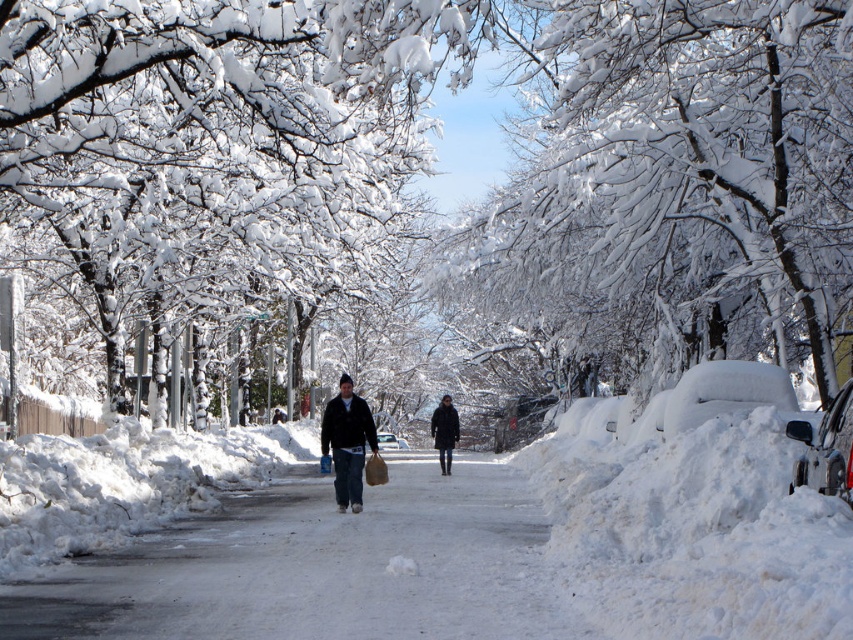
Does white snow-covered tree at center have a lesser width compared to dark blue denim jacket at center?

No.

Measure the distance between white snow-covered tree at center and dark blue denim jacket at center.

A distance of 43.16 feet exists between white snow-covered tree at center and dark blue denim jacket at center.

Locate an element on the screen. white snow-covered tree at center is located at coordinates (674, 189).

Identify the location of white snow-covered tree at center. The height and width of the screenshot is (640, 853). (674, 189).

At what (x,y) coordinates should I click in order to perform the action: click on white snow-covered tree at center. Please return your answer as a coordinate pair (x, y). Image resolution: width=853 pixels, height=640 pixels. Looking at the image, I should click on (674, 189).

Which is behind, point (714, 45) or point (445, 456)?

Positioned behind is point (445, 456).

In order to click on white snow-covered tree at center in this screenshot , I will do `click(674, 189)`.

Describe the element at coordinates (347, 442) in the screenshot. The image size is (853, 640). I see `dark blue denim jacket at center` at that location.

Between dark blue denim jacket at center and dark gray wool coat at center, which one has less height?

dark blue denim jacket at center

Which is behind, point (343, 449) or point (447, 451)?

Positioned behind is point (447, 451).

Find the location of `dark blue denim jacket at center`. dark blue denim jacket at center is located at coordinates (347, 442).